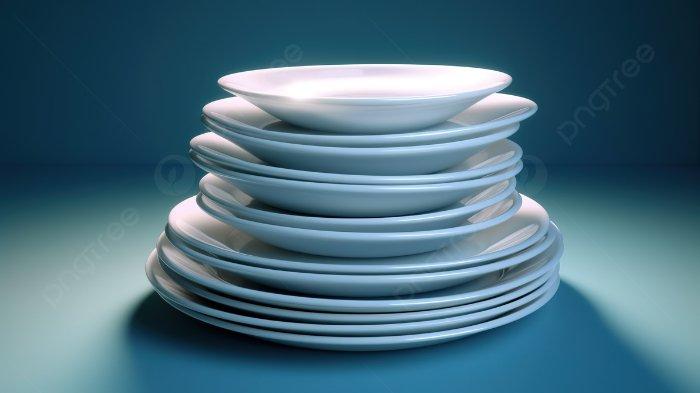
Identify the location of bowls. The width and height of the screenshot is (700, 393). (344, 86), (255, 112), (260, 135), (224, 141), (220, 160), (258, 185), (239, 199), (276, 220).